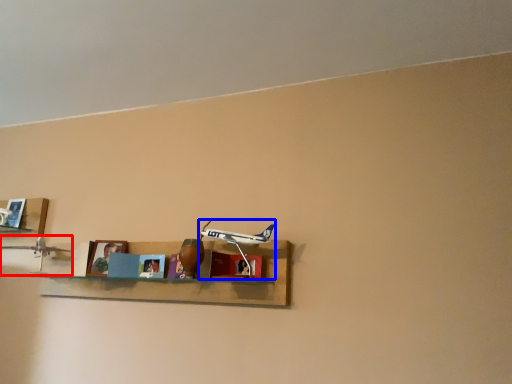
Question: Which of the following is the farthest to the observer, toy (highlighted by a red box) or toy (highlighted by a blue box)?

Choices:
 (A) toy
 (B) toy

Answer: (A)